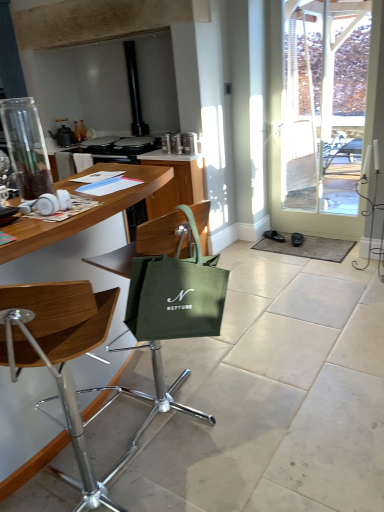
You are a GUI agent. You are given a task and a screenshot of the screen. Output one action in this format:
    pyautogui.click(x=<x>, y=<y>)
    Task: Click on the free location in front of black leather shoe at lower right, which ranks as the 1th footwear in right-to-left order
    The width and height of the screenshot is (384, 512).
    Given the screenshot: What is the action you would take?
    pyautogui.click(x=302, y=250)